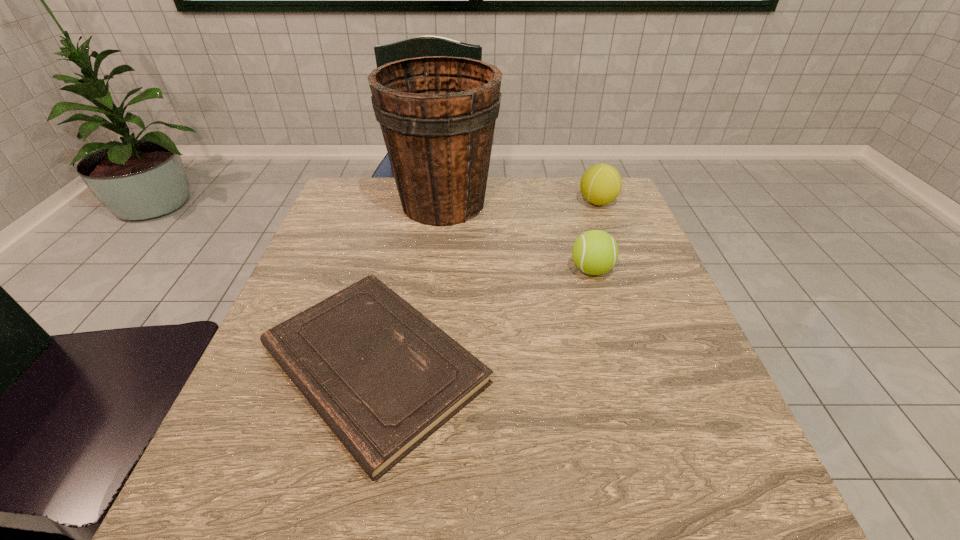
This screenshot has height=540, width=960. Find the location of `tennis ball present at the far edge`. tennis ball present at the far edge is located at coordinates (600, 184).

The height and width of the screenshot is (540, 960). I want to click on object that is at the near edge, so click(383, 377).

At what (x,y) coordinates should I click in order to perform the action: click on bucket that is at the left edge. Please return your answer as a coordinate pair (x, y). This screenshot has width=960, height=540. Looking at the image, I should click on (437, 114).

The image size is (960, 540). Find the location of `paperback book present at the left edge`. paperback book present at the left edge is located at coordinates (383, 377).

This screenshot has width=960, height=540. What are the coordinates of `object at the far left corner` in the screenshot? It's located at (437, 114).

The width and height of the screenshot is (960, 540). Find the location of `object that is at the near left corner`. object that is at the near left corner is located at coordinates (383, 377).

Image resolution: width=960 pixels, height=540 pixels. I want to click on object located at the far right corner, so click(x=600, y=184).

Where is `vacant space at the far edge`? This screenshot has height=540, width=960. vacant space at the far edge is located at coordinates (527, 201).

The image size is (960, 540). I want to click on vacant space at the near edge, so click(x=592, y=485).

In the image, there is a desktop. Find the location of `vacant space at the left edge`. vacant space at the left edge is located at coordinates (296, 437).